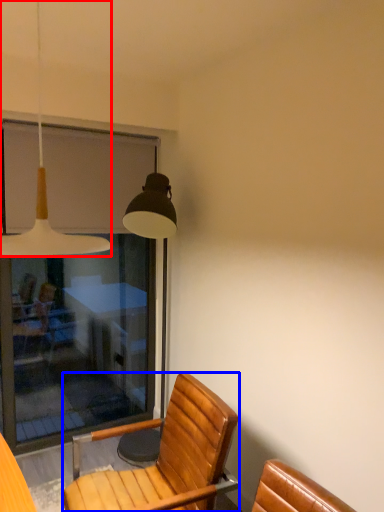
Question: Which object appears farthest to the camera in this image, lamp (highlighted by a red box) or chair (highlighted by a blue box)?

Choices:
 (A) lamp
 (B) chair

Answer: (B)